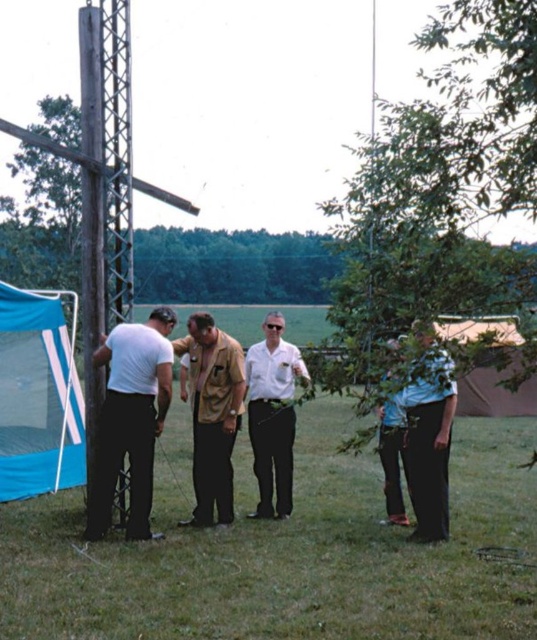
You are planning to set up a tent in the field. You have a blue fabric tent at lower left and a brown leather jacket at center. Which object is taller? Please answer based on their heights.

The blue fabric tent at lower left is taller than the brown leather jacket at center.